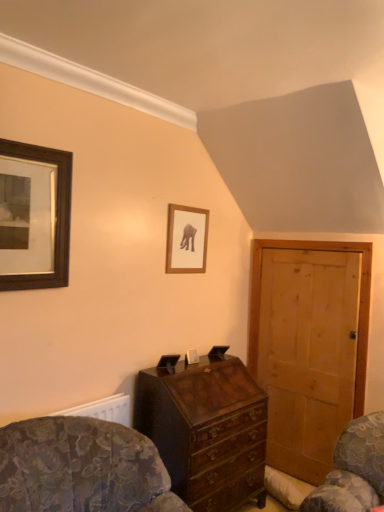
Question: Does wooden framed picture at center, the first picture frame positioned from the back, lie behind patterned fabric rocking chair at lower left?

Choices:
 (A) yes
 (B) no

Answer: (A)

Question: From a real-world perspective, is wooden framed picture at center, the first picture frame positioned from the back, on patterned fabric rocking chair at lower left?

Choices:
 (A) no
 (B) yes

Answer: (B)

Question: Can you confirm if wooden framed picture at center, arranged as the 2th picture frame when viewed from the left, is thinner than patterned fabric rocking chair at lower left?

Choices:
 (A) no
 (B) yes

Answer: (B)

Question: Would you consider wooden framed picture at center, positioned as the 1th picture frame in right-to-left order, to be distant from patterned fabric rocking chair at lower left?

Choices:
 (A) yes
 (B) no

Answer: (A)

Question: Is wooden framed picture at center, the first picture frame positioned from the back, closer to the viewer compared to patterned fabric rocking chair at lower left?

Choices:
 (A) yes
 (B) no

Answer: (B)

Question: Could you tell me if wooden framed picture at center, positioned as the 1th picture frame in right-to-left order, is facing patterned fabric rocking chair at lower left?

Choices:
 (A) yes
 (B) no

Answer: (B)

Question: Does wooden framed picture at upper left, positioned as the first picture frame in left-to-right order, have a smaller size compared to wooden framed picture at center, acting as the 2th picture frame starting from the front?

Choices:
 (A) no
 (B) yes

Answer: (A)

Question: From a real-world perspective, is wooden framed picture at upper left, positioned as the first picture frame in left-to-right order, located higher than wooden framed picture at center, acting as the 2th picture frame starting from the front?

Choices:
 (A) yes
 (B) no

Answer: (A)

Question: Is there a large distance between wooden framed picture at upper left, which is the second picture frame in back-to-front order, and wooden framed picture at center, arranged as the 2th picture frame when viewed from the left?

Choices:
 (A) no
 (B) yes

Answer: (A)

Question: From the image's perspective, is wooden framed picture at upper left, placed as the 2th picture frame when sorted from right to left, on wooden framed picture at center, positioned as the 1th picture frame in right-to-left order?

Choices:
 (A) no
 (B) yes

Answer: (B)

Question: Is wooden framed picture at upper left, the first picture frame positioned from the front, at the left side of wooden framed picture at center, acting as the 2th picture frame starting from the front?

Choices:
 (A) no
 (B) yes

Answer: (B)

Question: Does wooden framed picture at upper left, positioned as the first picture frame in left-to-right order, turn towards wooden framed picture at center, arranged as the 2th picture frame when viewed from the left?

Choices:
 (A) no
 (B) yes

Answer: (A)

Question: Can you confirm if mahogany wooden chest of drawers at center is shorter than wooden framed picture at upper left, placed as the 2th picture frame when sorted from right to left?

Choices:
 (A) no
 (B) yes

Answer: (A)